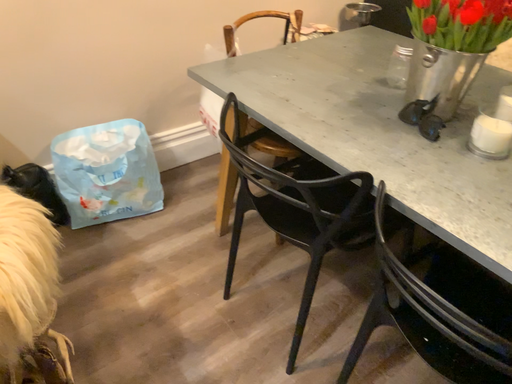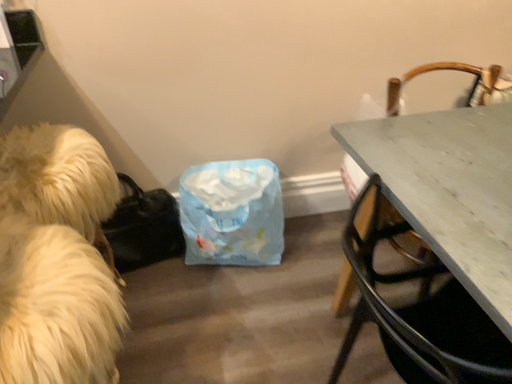
Question: Which way did the camera rotate in the video?

Choices:
 (A) rotated left
 (B) rotated right

Answer: (A)